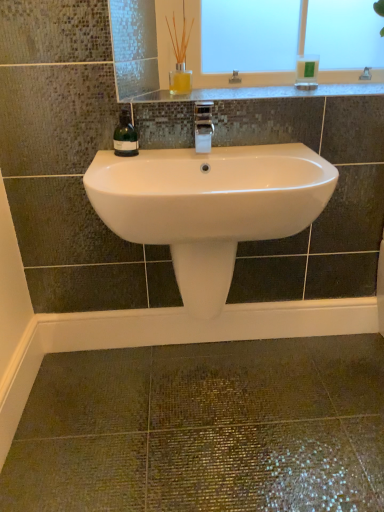
At what (x,y) coordinates should I click in order to perform the action: click on vacant space to the left of white ceramic faucet at center. Please return your answer as a coordinate pair (x, y). Looking at the image, I should click on (165, 151).